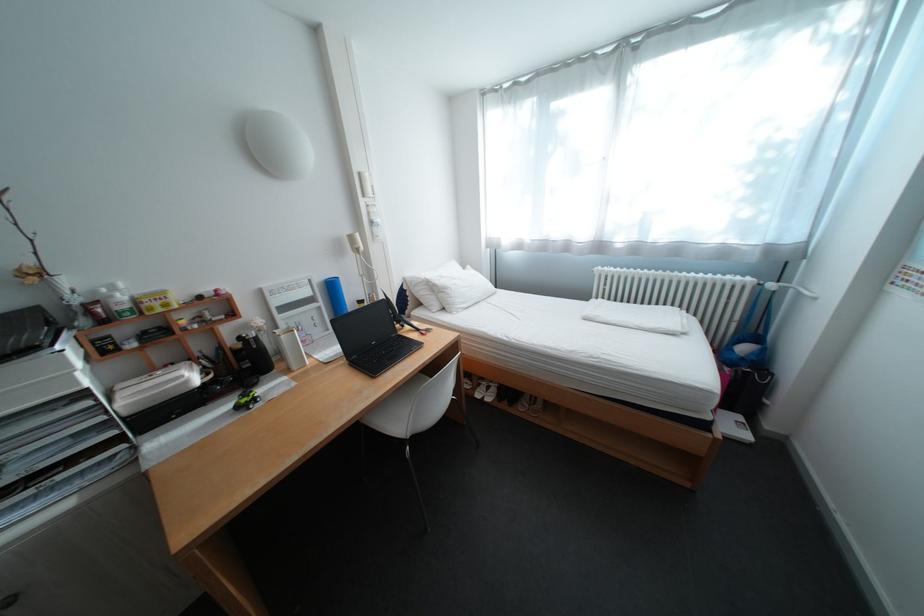
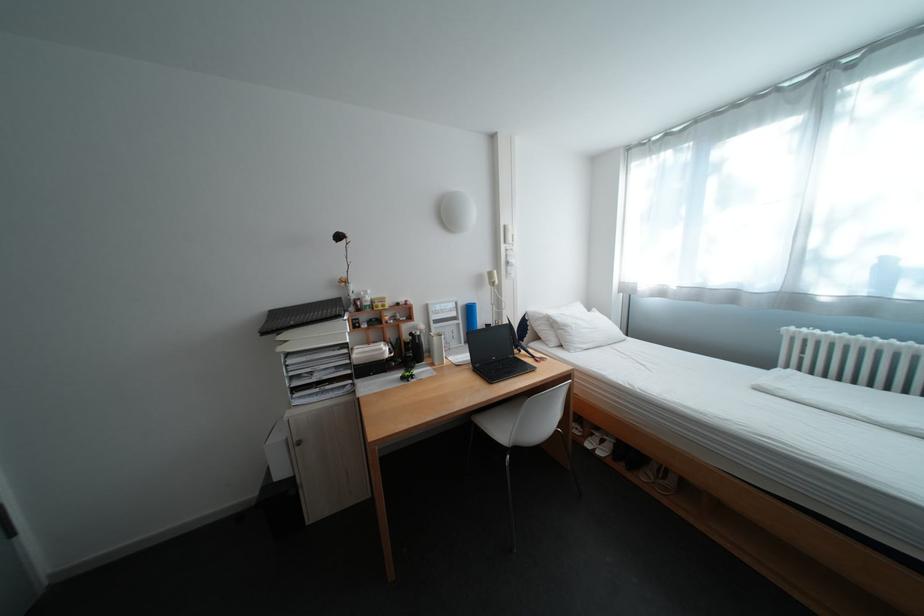
Question: The camera is either moving clockwise (left) or counter-clockwise (right) around the object. The first image is from the beginning of the video and the second image is from the end. Is the camera moving left or right when shooting the video?

Choices:
 (A) Left
 (B) Right

Answer: (B)